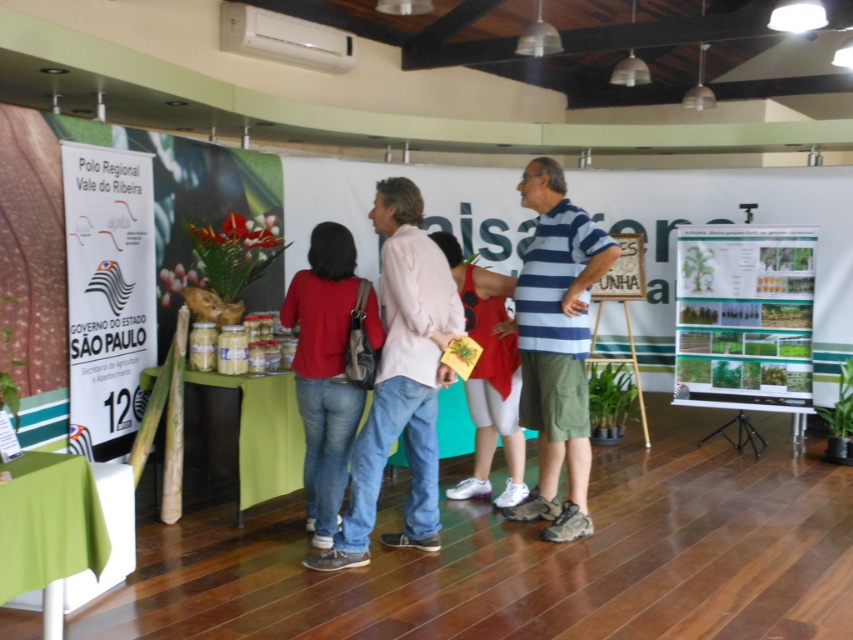
You are attending an event and want to take a photo of both the green matte poster at upper center and the striped cotton shirt at center. Which object should you position yourself to the left of to capture both in the frame?

You should position yourself to the left of the striped cotton shirt at center because the green matte poster at upper center is located to its right, ensuring both are within the camera frame.